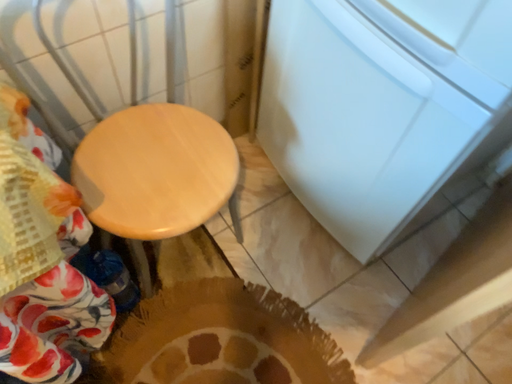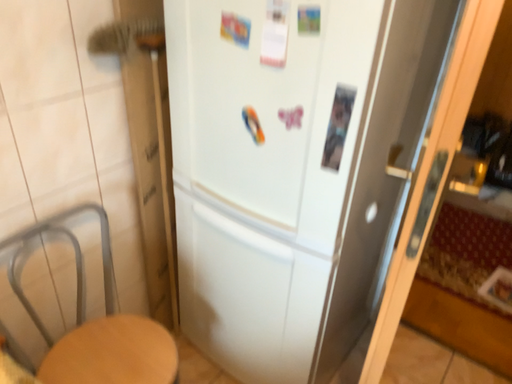
Question: Which way did the camera rotate in the video?

Choices:
 (A) rotated left
 (B) rotated right

Answer: (B)